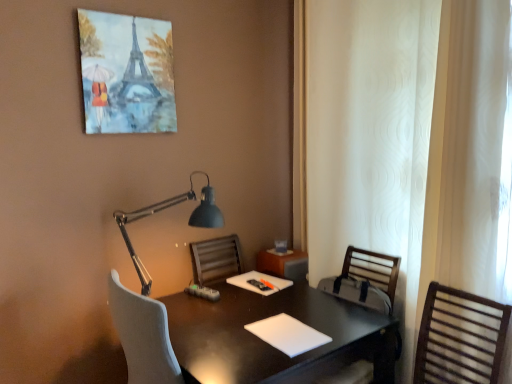
The width and height of the screenshot is (512, 384). Describe the element at coordinates (126, 73) in the screenshot. I see `matte canvas painting of eiffel tower at upper center` at that location.

Describe the element at coordinates (259, 283) in the screenshot. I see `white matte notepad at center, the 2th notepad positioned from the bottom` at that location.

Measure the distance between point (x=286, y=352) and camera.

Point (x=286, y=352) and camera are 5.10 feet apart from each other.

Identify the location of matte canvas painting of eiffel tower at upper center. (126, 73).

From the picture: Would you say white textured curtain at right contains matte canvas painting of eiffel tower at upper center?

No.

From the image's perspective, who appears lower, white textured curtain at right or matte canvas painting of eiffel tower at upper center?

white textured curtain at right is shown below in the image.

Is white textured curtain at right wider than matte canvas painting of eiffel tower at upper center?

Indeed, white textured curtain at right has a greater width compared to matte canvas painting of eiffel tower at upper center.

Considering the sizes of white textured curtain at right and matte canvas painting of eiffel tower at upper center in the image, is white textured curtain at right bigger or smaller than matte canvas painting of eiffel tower at upper center?

white textured curtain at right is bigger than matte canvas painting of eiffel tower at upper center.

Considering the positions of point (251, 299) and point (489, 16), is point (251, 299) closer or farther from the camera than point (489, 16)?

Point (251, 299) appears to be farther away from the viewer than point (489, 16).

Looking at this image, is black glossy desk at center bigger or smaller than white textured curtain at right?

Considering their sizes, black glossy desk at center takes up less space than white textured curtain at right.

Is black glossy desk at center wider than white textured curtain at right?

Correct, the width of black glossy desk at center exceeds that of white textured curtain at right.

From the picture: Considering the sizes of black glossy desk at center and white textured curtain at right in the image, is black glossy desk at center taller or shorter than white textured curtain at right?

Considering their sizes, black glossy desk at center has less height than white textured curtain at right.

Looking at the image, does black glossy desk at center seem bigger or smaller compared to white matte notepad at center, the 2th notepad positioned from the bottom?

black glossy desk at center is bigger than white matte notepad at center, the 2th notepad positioned from the bottom.

Would you say black glossy desk at center is a long distance from white matte notepad at center, the 2th notepad positioned from the bottom?

No, black glossy desk at center is not far away from white matte notepad at center, the 2th notepad positioned from the bottom.

In terms of height, does black glossy desk at center look taller or shorter compared to white matte notepad at center, which is the 2th notepad from front to back?

Clearly, black glossy desk at center is taller compared to white matte notepad at center, which is the 2th notepad from front to back.

Measure the distance between black glossy desk at center and white matte notepad at center, the 2th notepad positioned from the bottom.

black glossy desk at center and white matte notepad at center, the 2th notepad positioned from the bottom, are 14.68 inches apart from each other.

From the image's perspective, relative to white textured curtain at right, is matte canvas painting of eiffel tower at upper center above or below?

Clearly, from the image's perspective, matte canvas painting of eiffel tower at upper center is above white textured curtain at right.

Between matte canvas painting of eiffel tower at upper center and white textured curtain at right, which one appears on the left side from the viewer's perspective?

Positioned to the left is matte canvas painting of eiffel tower at upper center.

Does matte canvas painting of eiffel tower at upper center turn towards white textured curtain at right?

No, matte canvas painting of eiffel tower at upper center is not facing towards white textured curtain at right.

From a real-world perspective, which is physically below, matte canvas painting of eiffel tower at upper center or white textured curtain at right?

white textured curtain at right, from a real-world perspective.

Is brown wooden chair at right, placed as the second chair when sorted from back to front, placed right next to wooden slatted chair at right, placed as the second chair when sorted from front to back?

No, brown wooden chair at right, placed as the second chair when sorted from back to front, is not touching wooden slatted chair at right, placed as the second chair when sorted from front to back.

What's the angular difference between brown wooden chair at right, the 1th chair when ordered from front to back, and wooden slatted chair at right, the first chair from the back,'s facing directions?

They differ by 2.73 degrees in their facing directions.

Does brown wooden chair at right, placed as the second chair when sorted from back to front, have a larger size compared to wooden slatted chair at right, placed as the second chair when sorted from front to back?

No, brown wooden chair at right, placed as the second chair when sorted from back to front, is not bigger than wooden slatted chair at right, placed as the second chair when sorted from front to back.

In order to click on chair on the left of brown wooden chair at right, placed as the second chair when sorted from back to front in this screenshot , I will do `click(365, 280)`.

Does white matte notepad at center, which is the second notepad in top-to-bottom order, have a lesser height compared to wooden slatted chair at right, the first chair from the back?

Indeed, white matte notepad at center, which is the second notepad in top-to-bottom order, has a lesser height compared to wooden slatted chair at right, the first chair from the back.

Between white matte notepad at center, which is the first notepad from bottom to top, and wooden slatted chair at right, placed as the second chair when sorted from front to back, which one has larger size?

wooden slatted chair at right, placed as the second chair when sorted from front to back, is bigger.

Is white matte notepad at center, positioned as the 2th notepad in back-to-front order, inside the boundaries of wooden slatted chair at right, placed as the second chair when sorted from front to back, or outside?

white matte notepad at center, positioned as the 2th notepad in back-to-front order, cannot be found inside wooden slatted chair at right, placed as the second chair when sorted from front to back.

From the image's perspective, between white matte notepad at center, which is the second notepad in top-to-bottom order, and wooden slatted chair at right, the first chair from the back, who is located below?

wooden slatted chair at right, the first chair from the back, is shown below in the image.

How distant is matte canvas painting of eiffel tower at upper center from white matte notepad at center, the 2th notepad positioned from the bottom?

matte canvas painting of eiffel tower at upper center is 1.15 meters away from white matte notepad at center, the 2th notepad positioned from the bottom.

From a real-world perspective, is matte canvas painting of eiffel tower at upper center on top of white matte notepad at center, which is the 2th notepad from front to back?

Correct, in the physical world, matte canvas painting of eiffel tower at upper center is higher than white matte notepad at center, which is the 2th notepad from front to back.

Is matte canvas painting of eiffel tower at upper center to the left of white matte notepad at center, the 1th notepad from the top, from the viewer's perspective?

Yes, matte canvas painting of eiffel tower at upper center is to the left of white matte notepad at center, the 1th notepad from the top.

Does matte canvas painting of eiffel tower at upper center have a smaller size compared to white matte notepad at center, acting as the first notepad starting from the back?

No.

The height and width of the screenshot is (384, 512). What are the coordinates of `picture frame located behind the white textured curtain at right` in the screenshot? It's located at (126, 73).

Find the location of a particular element. desk below the white textured curtain at right (from a real-world perspective) is located at coordinates (270, 345).

Estimate the real-world distances between objects in this image. Which object is further from matte canvas painting of eiffel tower at upper center, matte black lamp at upper center or black glossy desk at center?

Based on the image, black glossy desk at center appears to be further to matte canvas painting of eiffel tower at upper center.

Looking at the image, which one is located further to brown wooden chair at right, the 1th chair when ordered from front to back, white matte notepad at center, which is the second notepad in top-to-bottom order, or black glossy desk at center?

white matte notepad at center, which is the second notepad in top-to-bottom order, is positioned further to the anchor brown wooden chair at right, the 1th chair when ordered from front to back.

Estimate the real-world distances between objects in this image. Which object is closer to white matte notepad at center, which is the first notepad from bottom to top, brown wooden chair at right, placed as the second chair when sorted from back to front, or matte canvas painting of eiffel tower at upper center?

Among the two, brown wooden chair at right, placed as the second chair when sorted from back to front, is located nearer to white matte notepad at center, which is the first notepad from bottom to top.

Which object lies nearer to the anchor point white matte notepad at center, the 2th notepad positioned from the bottom, matte canvas painting of eiffel tower at upper center or black glossy desk at center?

black glossy desk at center is positioned closer to the anchor white matte notepad at center, the 2th notepad positioned from the bottom.

Based on their spatial positions, is white matte notepad at center, the 1th notepad from the top, or brown wooden chair at right, the 1th chair when ordered from front to back, further from black glossy desk at center?

brown wooden chair at right, the 1th chair when ordered from front to back, is further to black glossy desk at center.

From the image, which object appears to be nearer to brown wooden chair at right, placed as the second chair when sorted from back to front, matte canvas painting of eiffel tower at upper center or white matte notepad at center, which is the second notepad in top-to-bottom order?

Among the two, white matte notepad at center, which is the second notepad in top-to-bottom order, is located nearer to brown wooden chair at right, placed as the second chair when sorted from back to front.

Looking at this image, considering their positions, is matte canvas painting of eiffel tower at upper center positioned closer to white textured curtain at right than wooden slatted chair at right, placed as the second chair when sorted from front to back?

The object closer to white textured curtain at right is wooden slatted chair at right, placed as the second chair when sorted from front to back.

Looking at the image, which one is located further to wooden slatted chair at right, placed as the second chair when sorted from front to back, matte black lamp at upper center or white matte notepad at center, which is the first notepad from bottom to top?

matte black lamp at upper center is positioned further to the anchor wooden slatted chair at right, placed as the second chair when sorted from front to back.

I want to click on notepad positioned between black glossy desk at center and white matte notepad at center, the 2th notepad positioned from the bottom, from near to far, so click(x=288, y=334).

The width and height of the screenshot is (512, 384). Find the location of `lamp positioned between white matte notepad at center, which is the second notepad in top-to-bottom order, and white matte notepad at center, acting as the first notepad starting from the back, from near to far`. lamp positioned between white matte notepad at center, which is the second notepad in top-to-bottom order, and white matte notepad at center, acting as the first notepad starting from the back, from near to far is located at coordinates click(164, 209).

What are the coordinates of `lamp between matte canvas painting of eiffel tower at upper center and white textured curtain at right from left to right` in the screenshot? It's located at (164, 209).

This screenshot has height=384, width=512. Find the location of `notepad between brown wooden chair at right, placed as the second chair when sorted from back to front, and wooden slatted chair at right, placed as the second chair when sorted from front to back, along the z-axis`. notepad between brown wooden chair at right, placed as the second chair when sorted from back to front, and wooden slatted chair at right, placed as the second chair when sorted from front to back, along the z-axis is located at coordinates (288, 334).